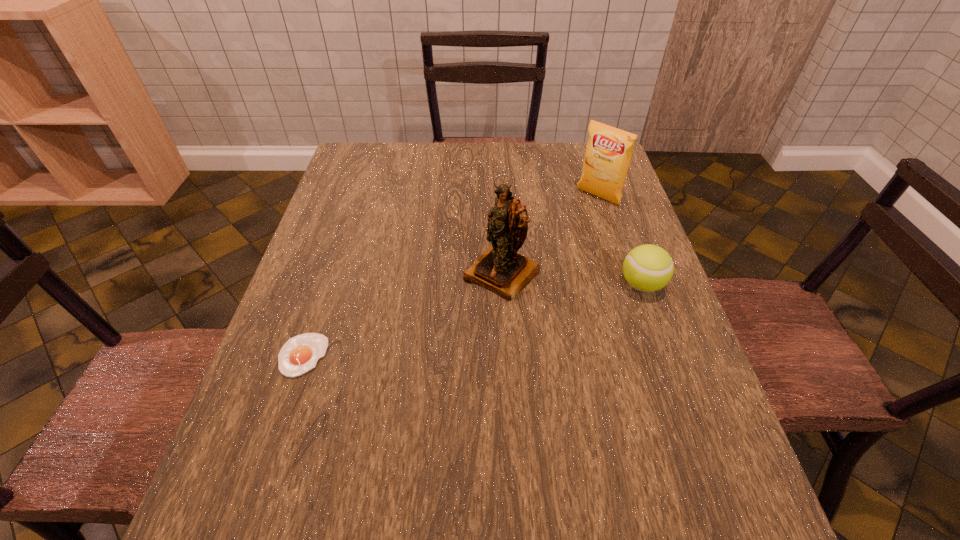
Find the location of a particular element. free space on the desktop that is between the shortest object and the tennis ball and is positioned on the front of the farthest object with the logo is located at coordinates (468, 321).

Locate an element on the screen. The height and width of the screenshot is (540, 960). vacant spot on the desktop that is between the shortest object and the second shortest object and is positioned on the front-facing side of the figurine is located at coordinates (451, 324).